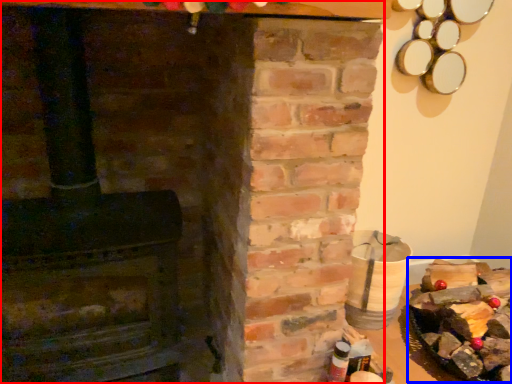
Question: Which point is further to the camera, fireplace (highlighted by a red box) or food (highlighted by a blue box)?

Choices:
 (A) fireplace
 (B) food

Answer: (B)